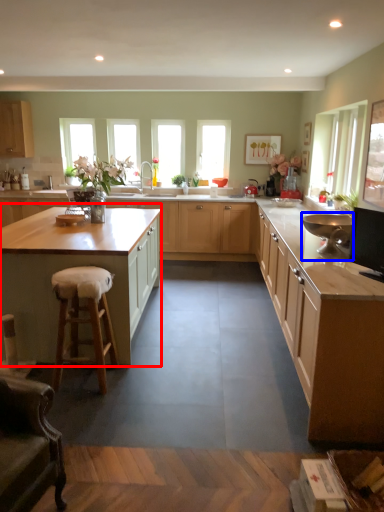
Question: Which object is closer to the camera taking this photo, cabinetry (highlighted by a red box) or appliance (highlighted by a blue box)?

Choices:
 (A) cabinetry
 (B) appliance

Answer: (B)